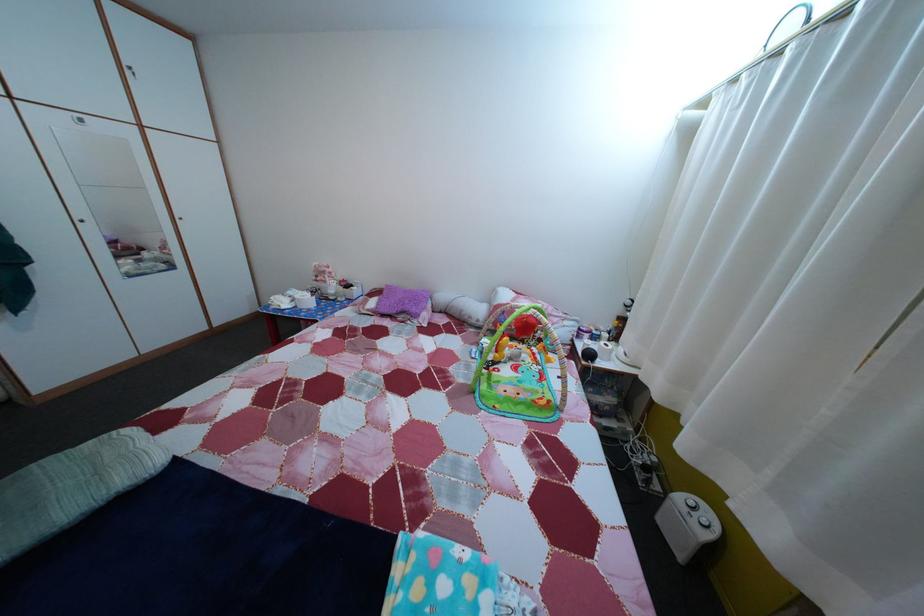
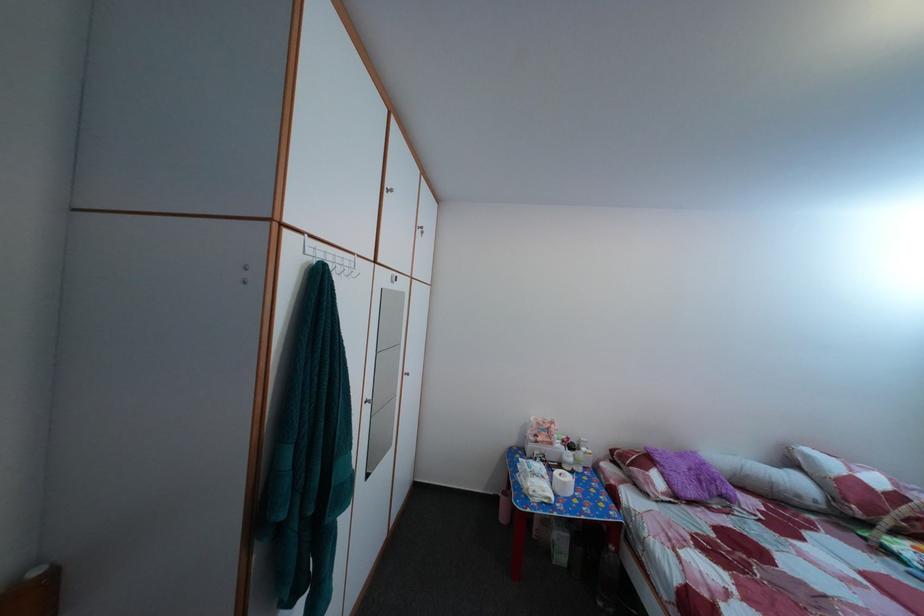
In the second image, find the point that corresponds to [505,301] in the first image.

(817, 464)